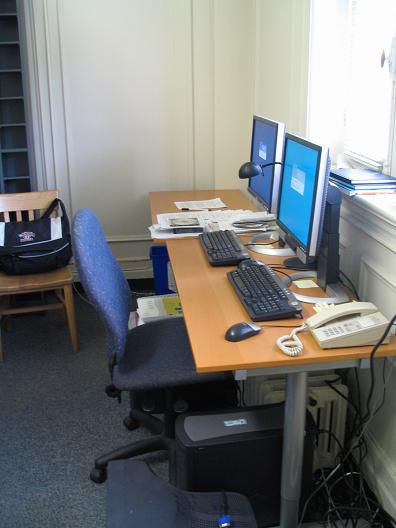
Locate an element on the screen. window is located at coordinates (379, 118).